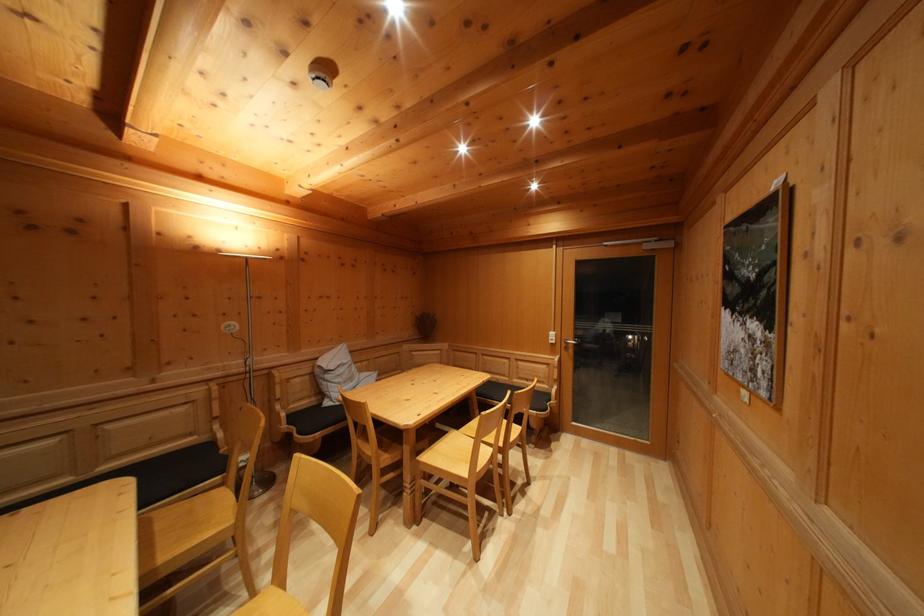
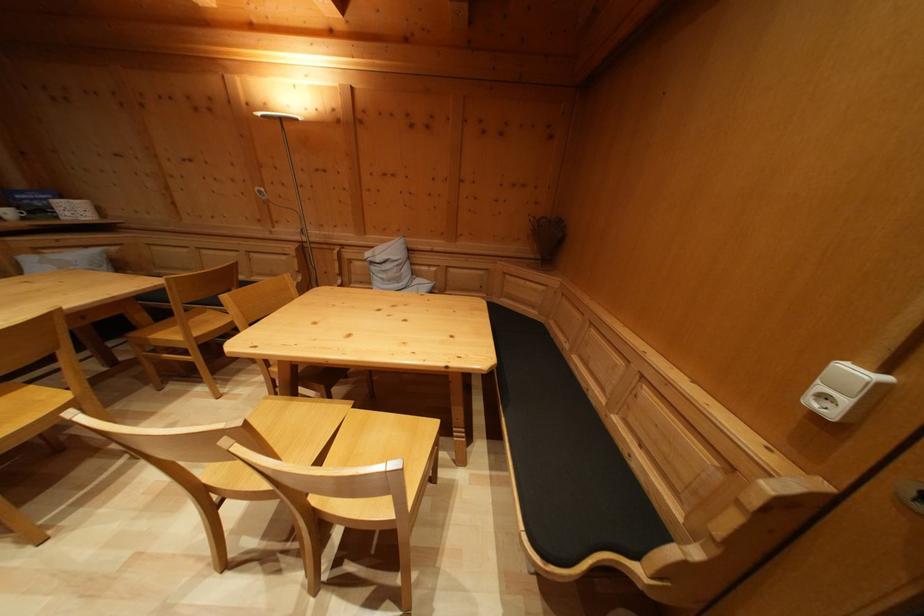
In the second image, find the point that corresponds to point 558,341 in the first image.

(859, 379)